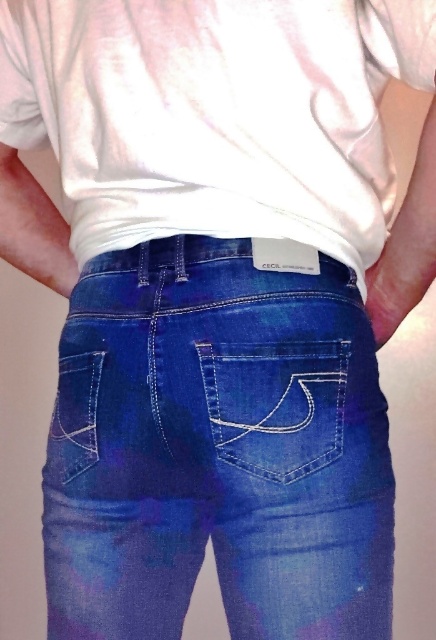
You are a fashion designer looking at a pair of jeans. You notice the denim at center and the denim pocket at center. Which part is taller?

The denim at center is taller than the denim pocket at center.

You are a tailor who needs to sew a decorative button between the denim at center and the denim pocket at center. Given the space between them, can you safely place the button without overlapping either the denim or the pocket?

The distance between the denim at center and the denim pocket at center is 3.45 inches. Since the button requires minimal space, it can be placed safely between them without overlapping.

You are a fashion designer examining the back of a pair of jeans. You notice two denim pockets. Which one is positioned closer to you, the denim pocket at center or the denim pocket at lower left?

The denim pocket at center is closer to the viewer than the denim pocket at lower left.